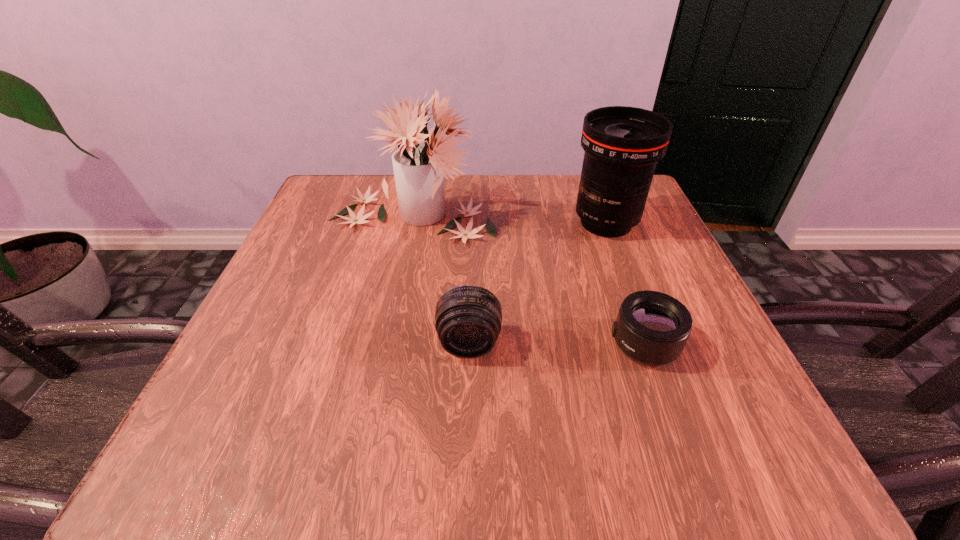
The width and height of the screenshot is (960, 540). I want to click on vacant space at the right edge, so click(x=628, y=259).

The image size is (960, 540). I want to click on vacant space at the far left corner of the desktop, so click(x=354, y=210).

The width and height of the screenshot is (960, 540). Find the location of `vacant space at the near right corner`. vacant space at the near right corner is located at coordinates (721, 412).

Identify the location of free space between the bouquet and the second shortest telephoto lens. (441, 280).

Where is `unoccupied area between the shortest object and the farthest telephoto lens`? This screenshot has width=960, height=540. unoccupied area between the shortest object and the farthest telephoto lens is located at coordinates (625, 284).

Where is `vacant space that is in between the leftmost telephoto lens and the tallest telephoto lens`? The height and width of the screenshot is (540, 960). vacant space that is in between the leftmost telephoto lens and the tallest telephoto lens is located at coordinates (538, 283).

You are a GUI agent. You are given a task and a screenshot of the screen. Output one action in this format:
    pyautogui.click(x=<x>, y=<y>)
    Task: Click on the vacant region between the farthest telephoto lens and the bouquet
    The image size is (960, 540).
    Given the screenshot: What is the action you would take?
    pyautogui.click(x=509, y=220)

Image resolution: width=960 pixels, height=540 pixels. I want to click on free spot between the second shortest object and the bouquet, so click(x=441, y=280).

Where is `vacant space that's between the second shortest telephoto lens and the shortest object`? This screenshot has width=960, height=540. vacant space that's between the second shortest telephoto lens and the shortest object is located at coordinates (557, 343).

I want to click on vacant region between the shortest object and the leftmost telephoto lens, so click(557, 343).